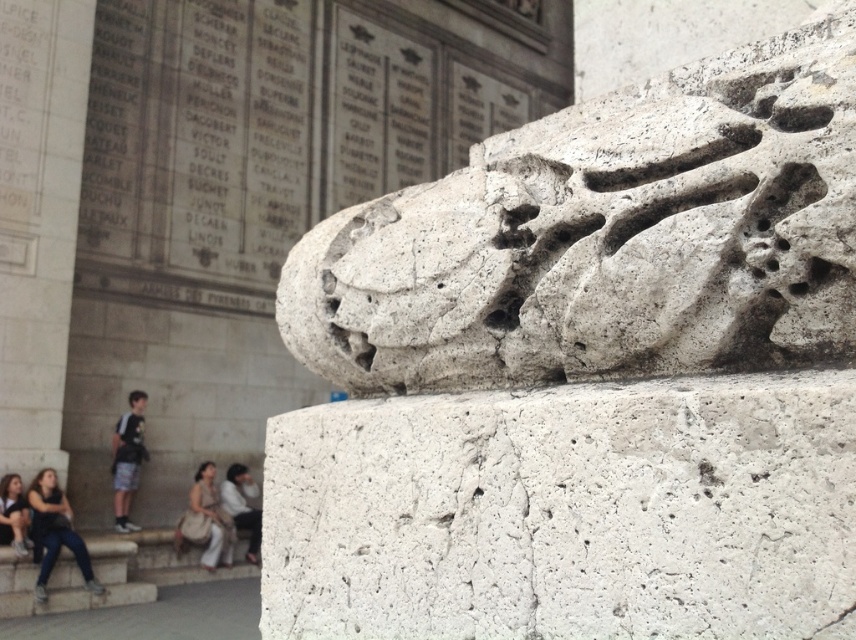
You are standing in front of the stone sculpture and want to touch both points mentioned. Which point should you reach for first, the one at point (259, 540) or the one at point (9, 524)?

You should reach for point (259, 540) first because it is closer to you than point (9, 524), which is further away.

You are a tourist standing in front of the monument. You see the white stone lion at upper center and the light beige pants at lower left. Which object is positioned higher in the image?

The white stone lion at upper center is positioned higher than the light beige pants at lower left.